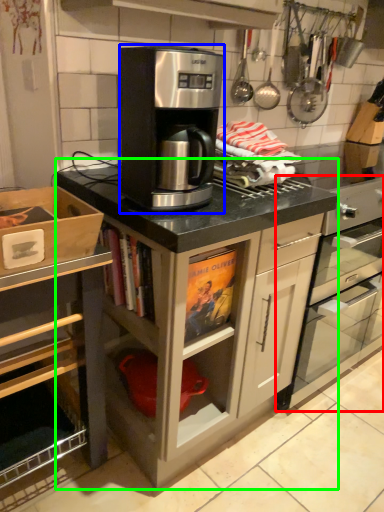
Question: Which object is positioned closest to home appliance (highlighted by a red box)? Select from kitchen appliance (highlighted by a blue box) and cabinetry (highlighted by a green box).

Choices:
 (A) kitchen appliance
 (B) cabinetry

Answer: (B)